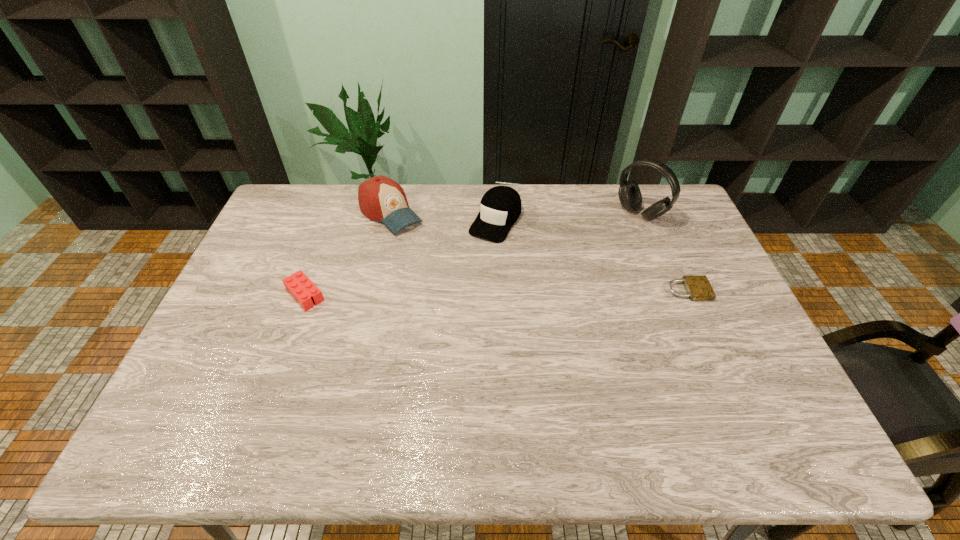
At what (x,y) coordinates should I click in order to perform the action: click on cap at the far edge. Please return your answer as a coordinate pair (x, y). The height and width of the screenshot is (540, 960). Looking at the image, I should click on (500, 207).

Identify the location of object situated at the left edge. This screenshot has height=540, width=960. (298, 284).

At what (x,y) coordinates should I click in order to perform the action: click on padlock that is at the right edge. Please return your answer as a coordinate pair (x, y). This screenshot has height=540, width=960. Looking at the image, I should click on (698, 288).

Identify the location of headset at the right edge. This screenshot has width=960, height=540. (629, 193).

This screenshot has width=960, height=540. Identify the location of object that is at the far right corner. (x=629, y=193).

This screenshot has width=960, height=540. I want to click on vacant space at the far edge of the desktop, so coord(557,210).

Locate an element on the screen. vacant area at the near edge is located at coordinates (372, 407).

Identify the location of vacant region at the left edge of the desktop. (261, 275).

Where is `free location at the near left corner`? free location at the near left corner is located at coordinates (236, 384).

The height and width of the screenshot is (540, 960). In order to click on unoccupied area between the shortest object and the leftmost object in this screenshot , I will do `click(496, 293)`.